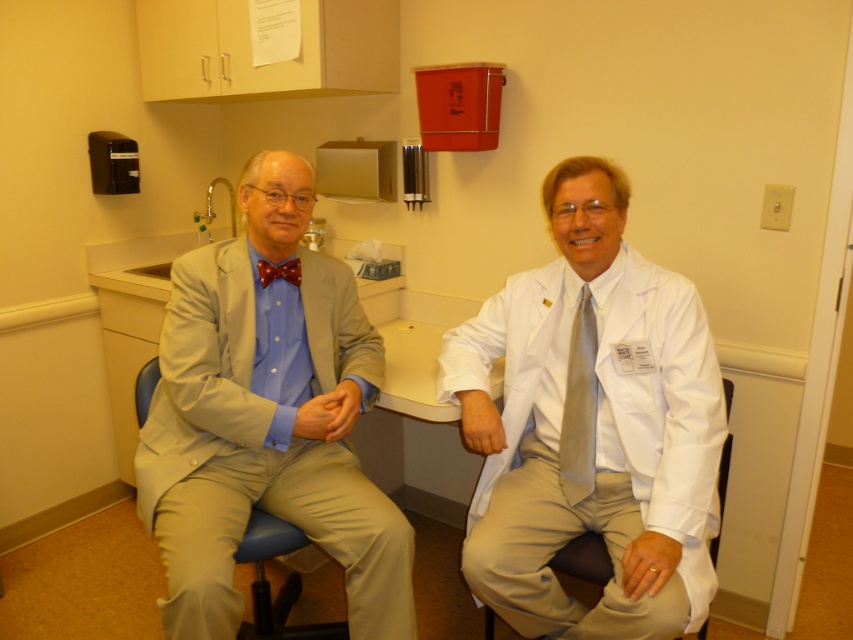
Question: Can you confirm if white smooth lab coat at center is bigger than smooth plastic swivel chair at center?

Choices:
 (A) no
 (B) yes

Answer: (B)

Question: Can you confirm if blue fabric swivel chair at left is positioned below brown shiny bow tie at center?

Choices:
 (A) yes
 (B) no

Answer: (A)

Question: Which point is farther to the camera?

Choices:
 (A) (291, 515)
 (B) (288, 262)
 (C) (561, 428)
 (D) (701, 589)

Answer: (B)

Question: Which object is the closest to the blue fabric swivel chair at left?

Choices:
 (A) brown shiny bow tie at center
 (B) silvery smooth tie at center
 (C) white smooth lab coat at center

Answer: (C)

Question: Which point is closer to the camera taking this photo?

Choices:
 (A) (296, 284)
 (B) (680, 616)
 (C) (283, 634)

Answer: (B)

Question: Does blue fabric swivel chair at left appear under brown shiny bow tie at center?

Choices:
 (A) yes
 (B) no

Answer: (A)